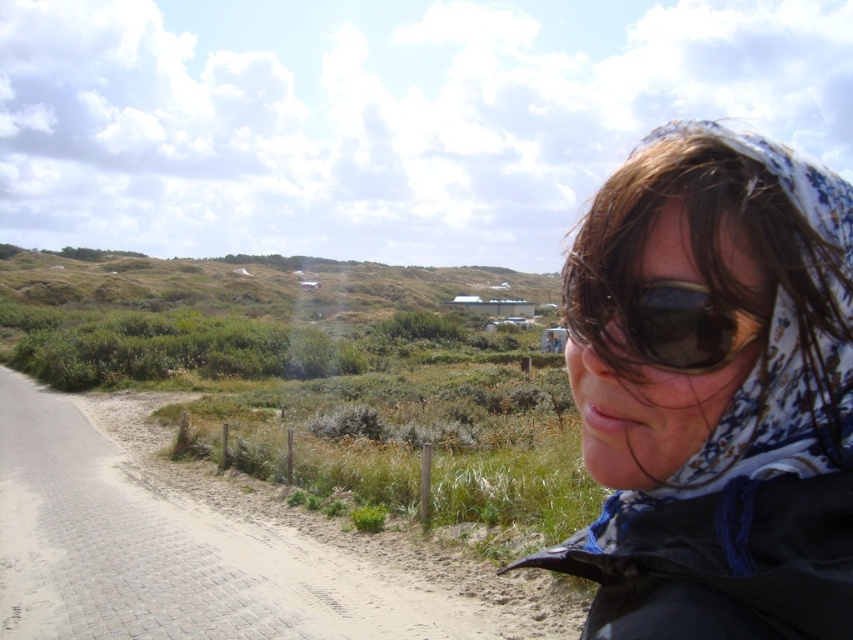
Looking at this image, you are a photographer trying to capture the scene with a camera that has a 12cm wide lens. You notice the white floral scarf at upper right and the black plastic sunglasses at center. Which object will require a wider lens to capture its full width without cropping?

The white floral scarf at upper right requires a wider lens because its width is larger than the black plastic sunglasses at center, so the lens must accommodate the larger size of the white floral scarf at upper right to capture it fully without cropping.

You are standing at the camera position and want to reach the point marked as point [712,204]. If your walking speed is 3 miles per hour, how long will it take you to reach that point?

The point [712,204] is 30.14 inches away from camera. Since 30.14 inches is approximately 0.0047 miles, at a speed of 3 mph, it would take roughly 0.0016 hours, which is about 0.096 minutes or roughly 6 seconds.

You are a photographer trying to capture the white floral scarf at upper right in your shot. The camera is positioned at the center of the image. Based on the coordinates provided, is the scarf located to the left or right of the camera? Please answer concisely.

The white floral scarf at upper right is located at coordinate point 0.614 on the x axis, which is to the right of the camera positioned at the center of the image. Therefore, the scarf is to the right of the camera.